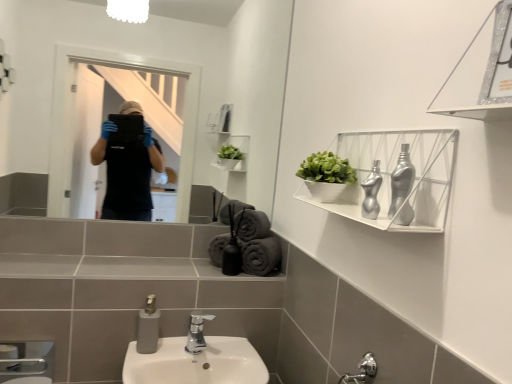
Question: From a real-world perspective, is metallic silver shelf at upper right, marked as the 1th shelf in a front-to-back arrangement, under gray matte soap dispenser at lower center?

Choices:
 (A) yes
 (B) no

Answer: (B)

Question: From the image's perspective, is metallic silver shelf at upper right, the second shelf viewed from the back, over gray matte soap dispenser at lower center?

Choices:
 (A) no
 (B) yes

Answer: (B)

Question: Is metallic silver shelf at upper right, the second shelf viewed from the back, oriented away from gray matte soap dispenser at lower center?

Choices:
 (A) yes
 (B) no

Answer: (B)

Question: From the image's perspective, is metallic silver shelf at upper right, the second shelf viewed from the back, below gray matte soap dispenser at lower center?

Choices:
 (A) no
 (B) yes

Answer: (A)

Question: Is metallic silver shelf at upper right, the second shelf viewed from the back, not within gray matte soap dispenser at lower center?

Choices:
 (A) no
 (B) yes

Answer: (B)

Question: Is gray cotton bath towel at center, acting as the first bath towel starting from the left, to the left or to the right of gray cotton bath towel at center, which is the 2th bath towel in right-to-left order, in the image?

Choices:
 (A) right
 (B) left

Answer: (B)

Question: Is point (217, 236) positioned closer to the camera than point (263, 231)?

Choices:
 (A) closer
 (B) farther

Answer: (B)

Question: From a real-world perspective, is gray cotton bath towel at center, acting as the first bath towel starting from the left, positioned above or below gray cotton bath towel at center, the third bath towel viewed from the left?

Choices:
 (A) above
 (B) below

Answer: (B)

Question: Is gray cotton bath towel at center, which ranks as the 4th bath towel in right-to-left order, taller or shorter than gray cotton bath towel at center, the third bath towel viewed from the left?

Choices:
 (A) short
 (B) tall

Answer: (B)

Question: Considering the positions of polished chrome faucet at center and gray cotton bath towel at center, which ranks as the 4th bath towel in right-to-left order, in the image, is polished chrome faucet at center taller or shorter than gray cotton bath towel at center, which ranks as the 4th bath towel in right-to-left order,?

Choices:
 (A) short
 (B) tall

Answer: (A)

Question: Is point (197, 326) closer or farther from the camera than point (226, 233)?

Choices:
 (A) farther
 (B) closer

Answer: (B)

Question: Do you think polished chrome faucet at center is within gray cotton bath towel at center, acting as the first bath towel starting from the left, or outside of it?

Choices:
 (A) inside
 (B) outside

Answer: (B)

Question: Visually, is polished chrome faucet at center positioned to the left or to the right of gray cotton bath towel at center, acting as the first bath towel starting from the left?

Choices:
 (A) left
 (B) right

Answer: (A)

Question: Is gray cotton towels at lower center, the 4th bath towel viewed from the left, inside the boundaries of metallic silver shelf at upper right, the second shelf viewed from the back, or outside?

Choices:
 (A) inside
 (B) outside

Answer: (B)

Question: Considering the positions of point (247, 258) and point (495, 92), is point (247, 258) closer or farther from the camera than point (495, 92)?

Choices:
 (A) closer
 (B) farther

Answer: (B)